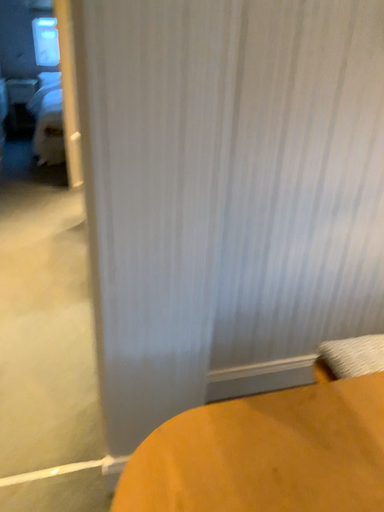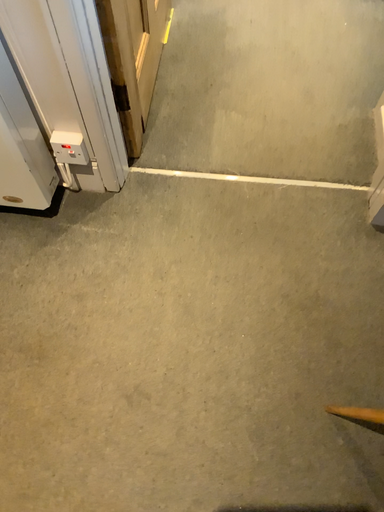
Question: How did the camera likely rotate when shooting the video?

Choices:
 (A) rotated right
 (B) rotated left

Answer: (B)